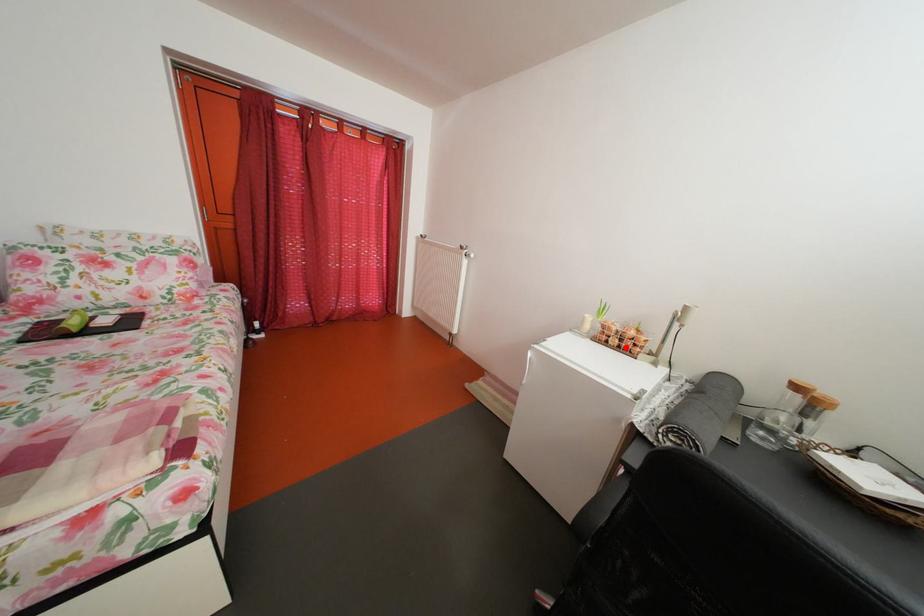
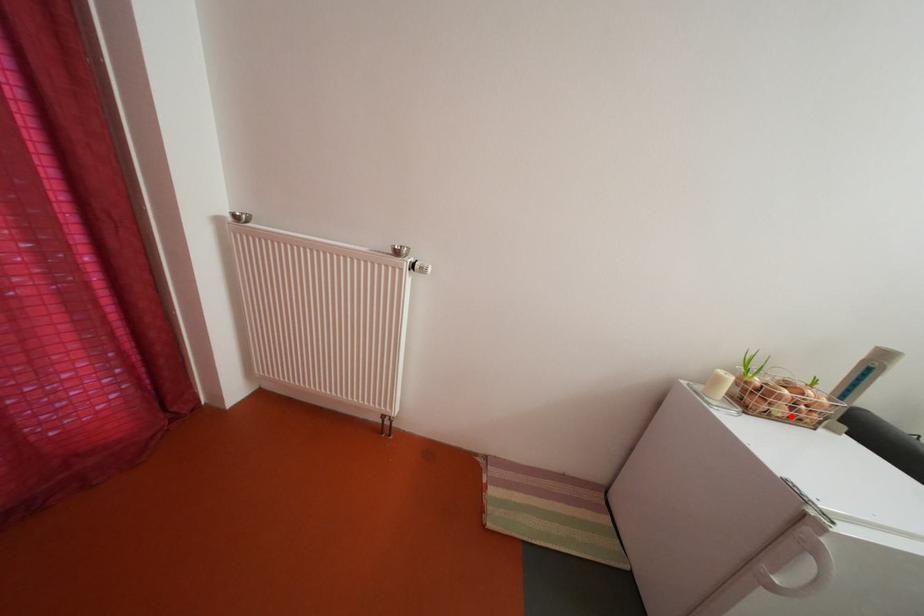
I am providing you with two images of the same scene from different viewpoints. A red point is marked on the first image and another point is marked on the second image. Does the point marked in image1 correspond to the same location as the one in image2?

Yes